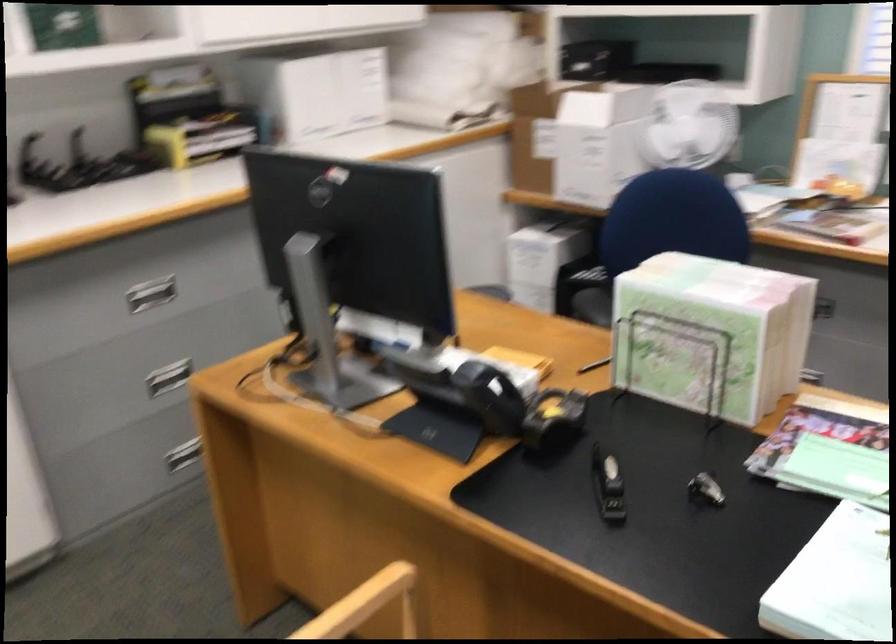
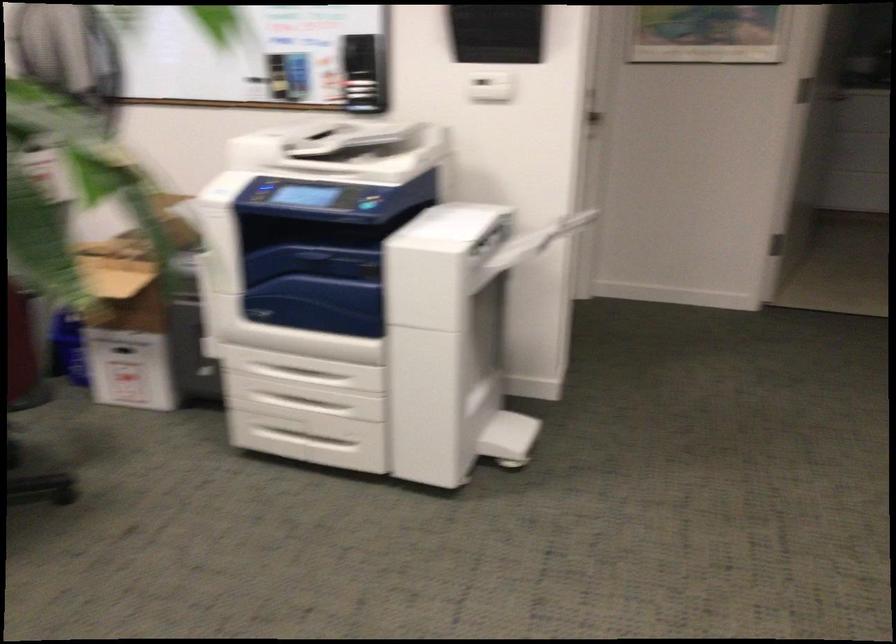
The images are taken continuously from a first-person perspective. In which direction is your viewpoint rotating?

The camera's rotation is toward right-down.